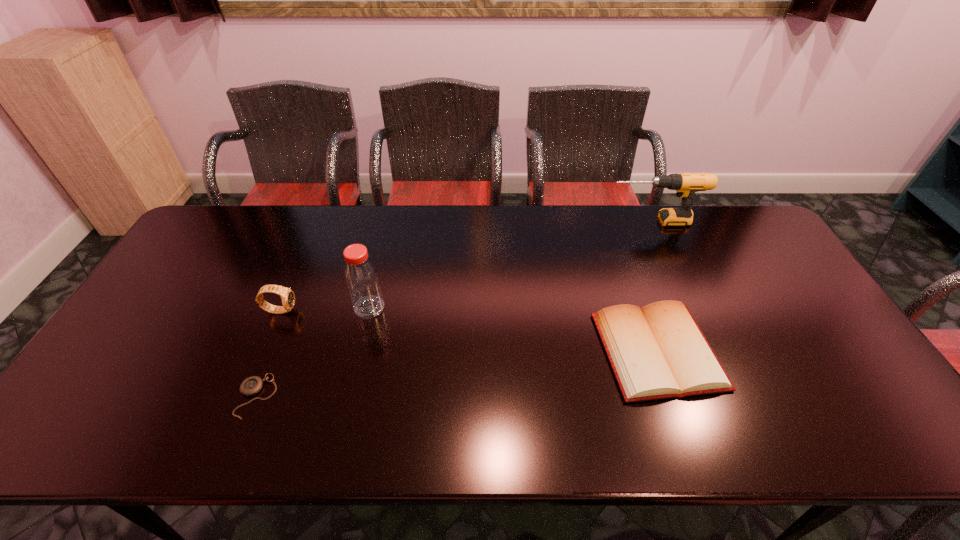
This screenshot has height=540, width=960. Identify the location of vacant space situated 0.090m on the front of the second shortest object. (688, 441).

Locate an element on the screen. free space located 0.070m on the right of the shortest object is located at coordinates (303, 396).

You are a GUI agent. You are given a task and a screenshot of the screen. Output one action in this format:
    pyautogui.click(x=<x>, y=<y>)
    Task: Click on the object located at the far edge
    
    Given the screenshot: What is the action you would take?
    pyautogui.click(x=686, y=184)

Locate an element on the screen. The width and height of the screenshot is (960, 540). object that is at the near edge is located at coordinates (252, 385).

Where is `free space at the far edge of the desktop`? This screenshot has height=540, width=960. free space at the far edge of the desktop is located at coordinates coord(351,206).

Where is `blank space at the near edge of the desktop`? Image resolution: width=960 pixels, height=540 pixels. blank space at the near edge of the desktop is located at coordinates (341, 431).

The height and width of the screenshot is (540, 960). Find the location of `free space at the left edge`. free space at the left edge is located at coordinates (136, 406).

Image resolution: width=960 pixels, height=540 pixels. In order to click on free space at the right edge of the desktop in this screenshot , I will do `click(819, 408)`.

Where is `vacant space at the far left corner of the desktop`? vacant space at the far left corner of the desktop is located at coordinates (252, 220).

This screenshot has height=540, width=960. In the image, there is a desktop. Identify the location of free space at the far right corner. (739, 249).